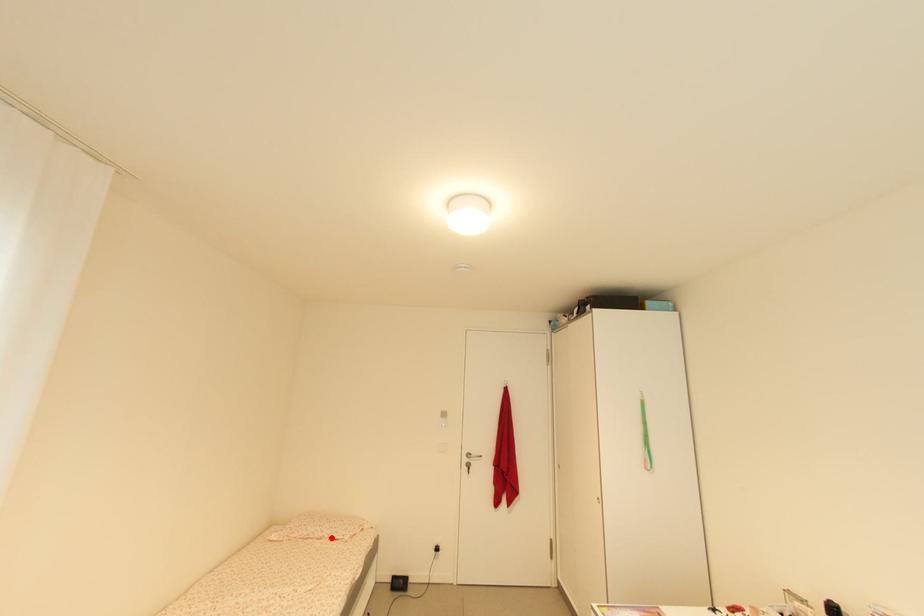
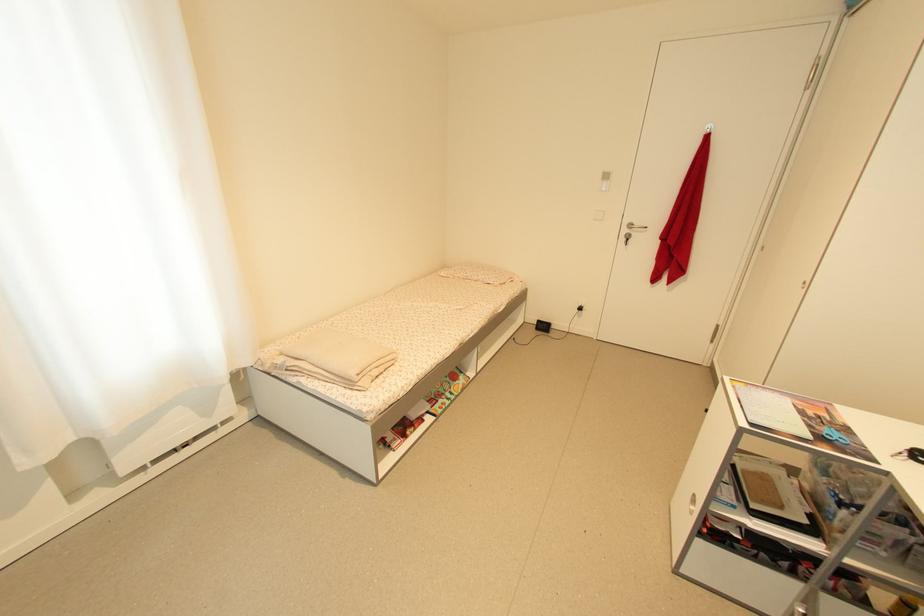
Question: I am providing you with two images of the same scene from different viewpoints. A red point is marked on the first image. Can you still see the location of the red point in image 2?

Choices:
 (A) Yes
 (B) No

Answer: (A)